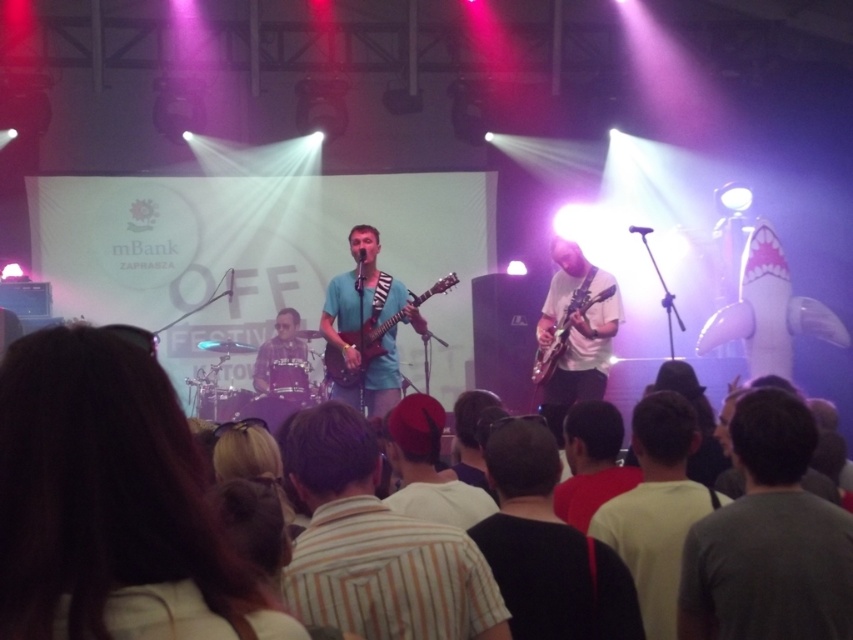
Question: Does red felt hat at center appear on the right side of plaid fabric shirt at center?

Choices:
 (A) yes
 (B) no

Answer: (A)

Question: Which object appears farthest from the camera in this image?

Choices:
 (A) brown hair at center
 (B) gray cotton shirt at center

Answer: (B)

Question: Is brown hair at center positioned at the back of striped cotton shirt at center?

Choices:
 (A) yes
 (B) no

Answer: (B)

Question: Which point is closer to the camera?

Choices:
 (A) red felt hat at center
 (B) striped cotton shirt at center
 (C) white matte guitar at center
 (D) matte blue electric guitar at center

Answer: (B)

Question: In this image, where is brown hair at center located relative to plaid fabric shirt at center?

Choices:
 (A) below
 (B) above

Answer: (B)

Question: Which point appears closest to the camera in this image?

Choices:
 (A) (614, 288)
 (B) (404, 508)
 (C) (596, 289)
 (D) (13, 636)

Answer: (D)